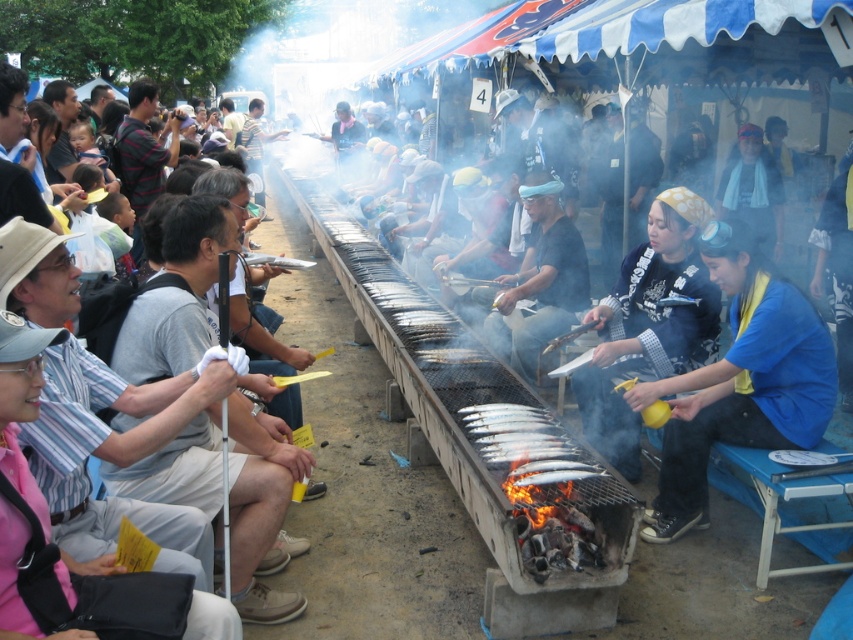
Is blue fabric shirt at lower right wider than silver metallic fish at center?

Correct, the width of blue fabric shirt at lower right exceeds that of silver metallic fish at center.

Who is positioned more to the left, blue fabric shirt at lower right or silver metallic fish at center?

silver metallic fish at center is more to the left.

Is point (700, 508) positioned before point (543, 472)?

No, (700, 508) is behind (543, 472).

I want to click on blue fabric shirt at lower right, so click(740, 381).

The width and height of the screenshot is (853, 640). What do you see at coordinates (268, 472) in the screenshot? I see `matte gray shirt at left` at bounding box center [268, 472].

Does point (277, 561) come closer to viewer compared to point (575, 480)?

No, it is behind (575, 480).

Which is behind, point (267, 490) or point (553, 472)?

The point (553, 472) is more distant.

I want to click on matte gray shirt at left, so click(x=268, y=472).

Find the location of a particular element. blue fabric shirt at lower right is located at coordinates (740, 381).

Can you confirm if blue fabric shirt at lower right is thinner than matte gray shirt at left?

No, blue fabric shirt at lower right is not thinner than matte gray shirt at left.

Find the location of a particular element. This screenshot has height=640, width=853. blue fabric shirt at lower right is located at coordinates (740, 381).